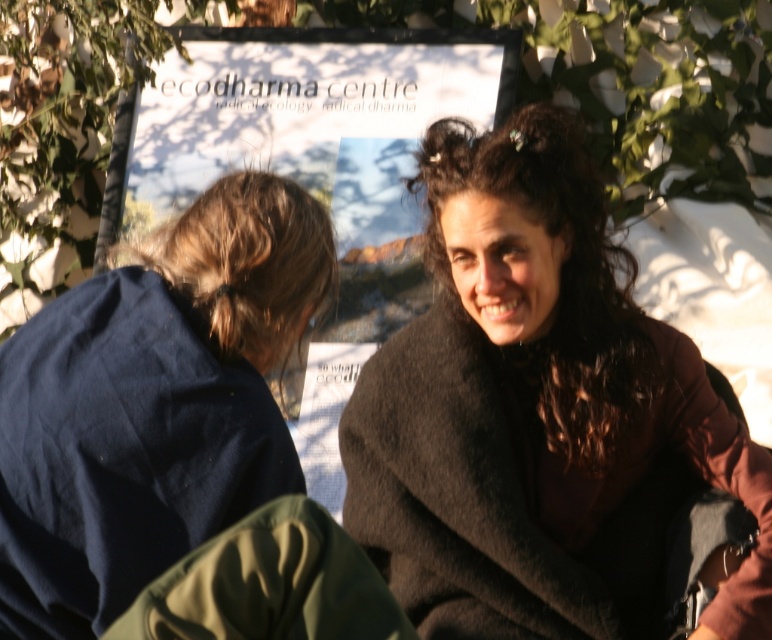
You are a photographer trying to capture both the brown woolen coat at center and the brown fuzzy blanket at upper right in a single frame. Based on their sizes, which object should you focus on first to ensure both are in the frame?

The brown woolen coat at center is taller than the brown fuzzy blanket at upper right, so focusing on the brown woolen coat at center first would allow you to adjust the frame to include both objects.

You are a photographer trying to capture a clear shot of the brown hair at left without the brown fuzzy blanket at upper right appearing in the frame. Based on their positions, is this possible?

The brown fuzzy blanket at upper right is positioned under brown hair at left, so the blanket is below the hair. Therefore, it is possible to capture the brown hair at left without the blanket in the frame by adjusting the camera angle to avoid the lower area where the blanket is located.

You are standing in front of the Ecodharma Centre signboard and want to place both the brown woolen coat at center and the brown fuzzy blanket at upper right on a shelf. Which item should you place first if you want to arrange them in the order they appear from left to right as viewed from the signboard?

The brown fuzzy blanket at upper right should be placed first on the left side of the shelf since it is positioned to the left of the brown woolen coat at center in the image.